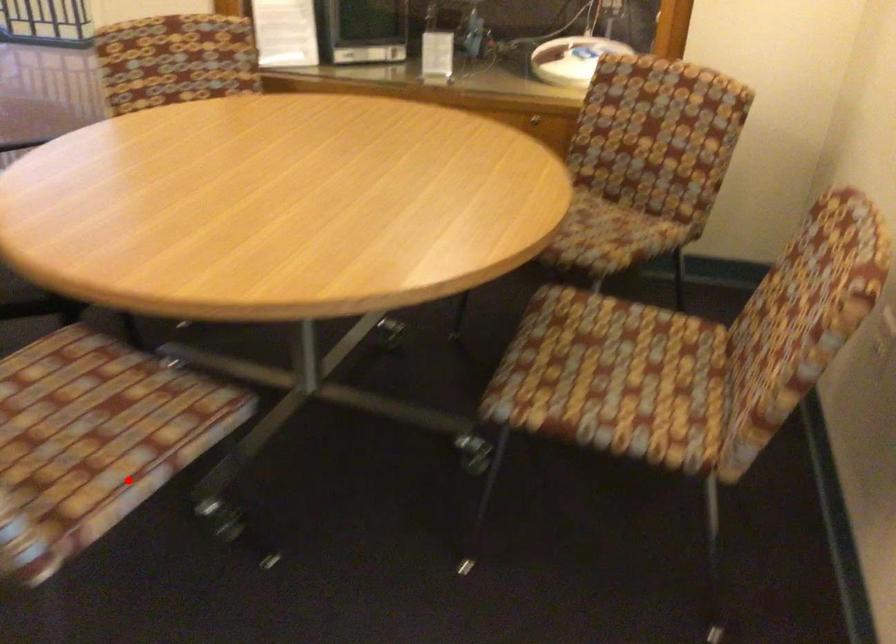
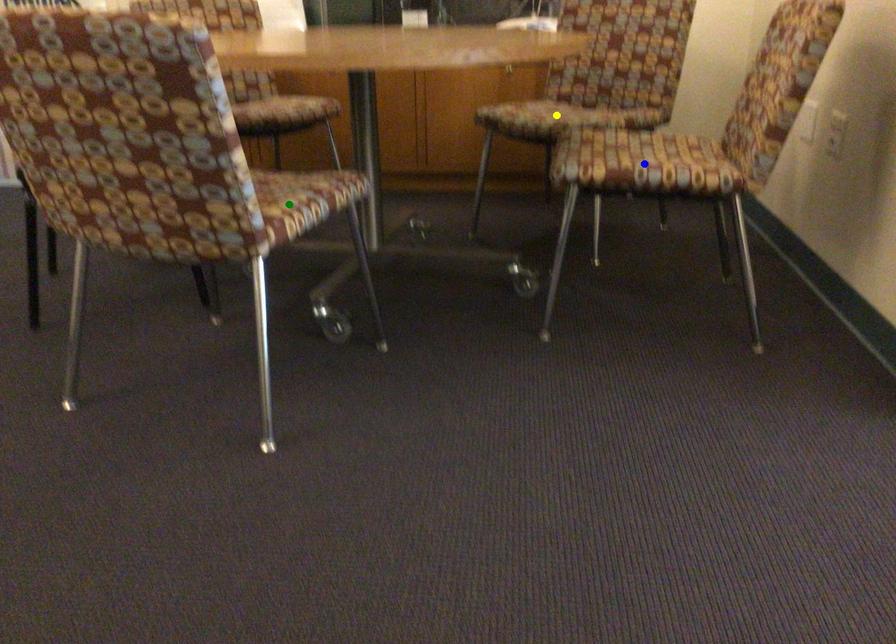
Question: I am providing you with two images of the same scene from different viewpoints. A red point is marked on the first image. You are given multiple points on the second image. Which point in image 2 represents the same 3d spot as the red point in image 1?

Choices:
 (A) blue point
 (B) yellow point
 (C) green point

Answer: (C)